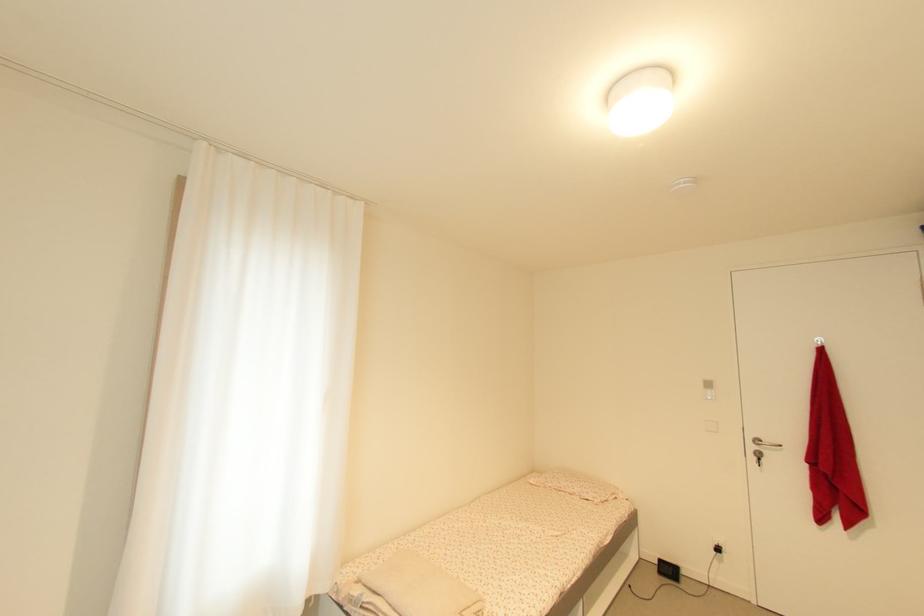
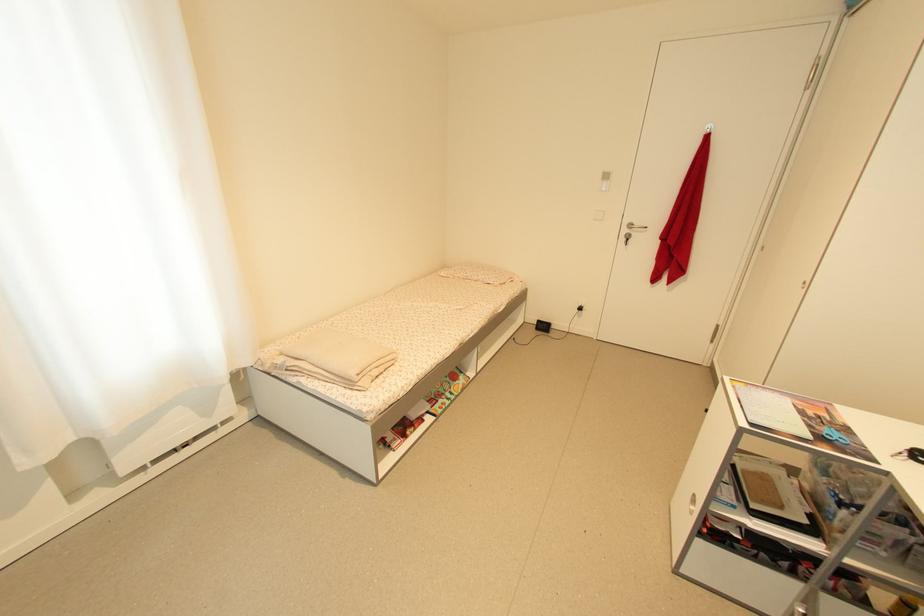
The point at [762,443] is marked in the first image. Where is the corresponding point in the second image?

(636, 227)